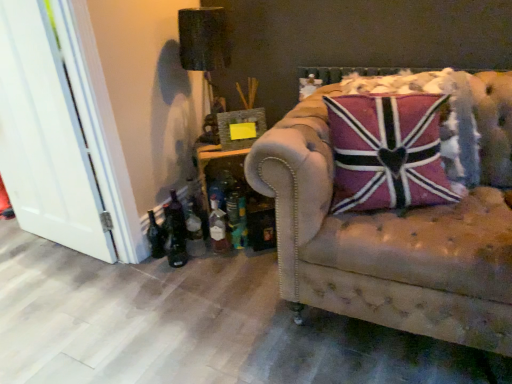
Question: Is leather tufted couch at right outside translucent glass bottle at lower left, marked as the 2th bottle in a right-to-left arrangement?

Choices:
 (A) no
 (B) yes

Answer: (B)

Question: Is the position of leather tufted couch at right more distant than that of translucent glass bottle at lower left, marked as the 2th bottle in a right-to-left arrangement?

Choices:
 (A) yes
 (B) no

Answer: (B)

Question: Considering the relative sizes of leather tufted couch at right and translucent glass bottle at lower left, marked as the 2th bottle in a right-to-left arrangement, in the image provided, is leather tufted couch at right smaller than translucent glass bottle at lower left, marked as the 2th bottle in a right-to-left arrangement,?

Choices:
 (A) yes
 (B) no

Answer: (B)

Question: From a real-world perspective, is leather tufted couch at right under translucent glass bottle at lower left, the 2th bottle in the left-to-right sequence?

Choices:
 (A) no
 (B) yes

Answer: (A)

Question: Can you confirm if leather tufted couch at right is shorter than translucent glass bottle at lower left, the 2th bottle in the left-to-right sequence?

Choices:
 (A) yes
 (B) no

Answer: (B)

Question: Can you see leather tufted couch at right touching translucent glass bottle at lower left, marked as the 2th bottle in a right-to-left arrangement?

Choices:
 (A) yes
 (B) no

Answer: (B)

Question: Can you confirm if green glass bottle at lower left is smaller than white wood door at left?

Choices:
 (A) no
 (B) yes

Answer: (B)

Question: Is green glass bottle at lower left not close to white wood door at left?

Choices:
 (A) yes
 (B) no

Answer: (B)

Question: Is white wood door at left located within green glass bottle at lower left?

Choices:
 (A) yes
 (B) no

Answer: (B)

Question: Is green glass bottle at lower left positioned beyond the bounds of white wood door at left?

Choices:
 (A) yes
 (B) no

Answer: (A)

Question: Is green glass bottle at lower left touching white wood door at left?

Choices:
 (A) yes
 (B) no

Answer: (B)

Question: Is green glass bottle at lower left further to the viewer compared to white wood door at left?

Choices:
 (A) yes
 (B) no

Answer: (A)

Question: From the image's perspective, is green glass bottle at lower left on dark glass bottle at lower left, the 3th bottle when ordered from right to left?

Choices:
 (A) yes
 (B) no

Answer: (A)